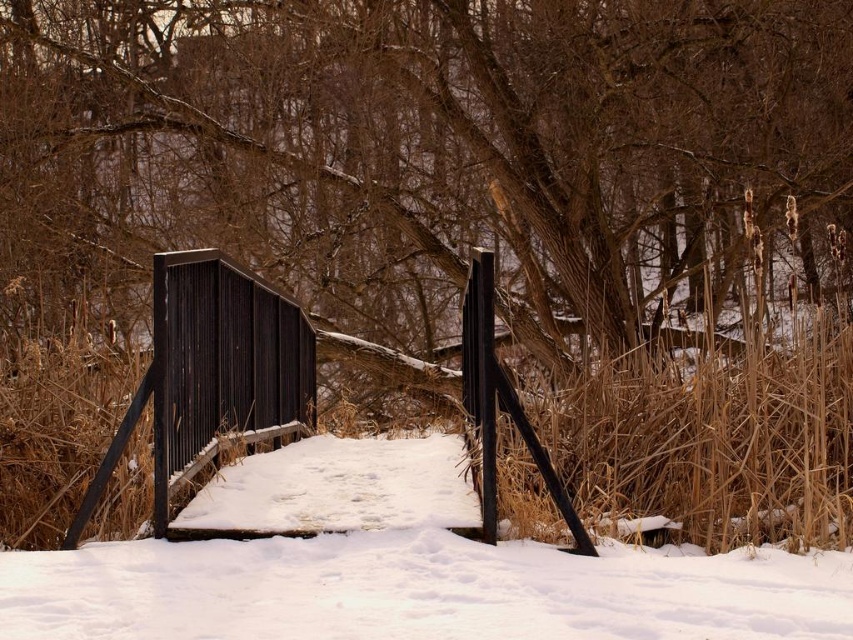
You are standing on the bridge and want to place a small snowman on the white powdery snow at center. Can you see the snowman from the top of the black corrugated metal fence at center?

The white powdery snow at center is below the black corrugated metal fence at center. Since the snow is positioned below the fence, the snowman placed there would be obscured by the fence, making it invisible from the top of the fence.

You are standing at the snow covered bridge and see two points in the scene. The first point is at coordinates point (65, 620) and the second point is at point (187, 259). Which point is closer to you?

Point (65, 620) is in front of point (187, 259), so it is closer to you.

You are standing on the snow covered bridge and want to take a photo of the brown wood tree at center and the white powdery snow at center. Which object will appear closer to the camera in the photo?

The brown wood tree at center will appear closer to the camera because the white powdery snow at center is behind it.